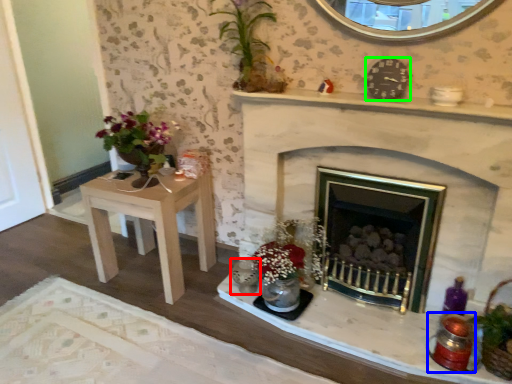
Question: Estimate the real-world distances between objects in this image. Which object is closer to candle holder (highlighted by a red box), candle holder (highlighted by a blue box) or clock (highlighted by a green box)?

Choices:
 (A) candle holder
 (B) clock

Answer: (A)